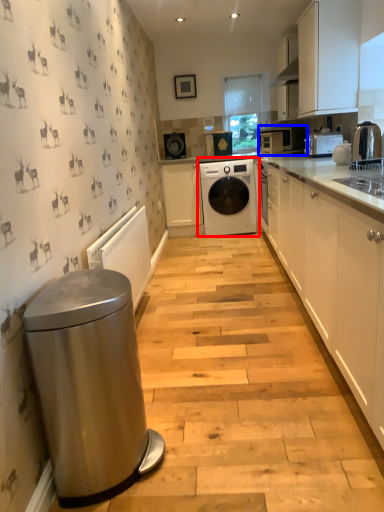
Question: Which point is closer to the camera, washing machine (highlighted by a red box) or home appliance (highlighted by a blue box)?

Choices:
 (A) washing machine
 (B) home appliance

Answer: (A)